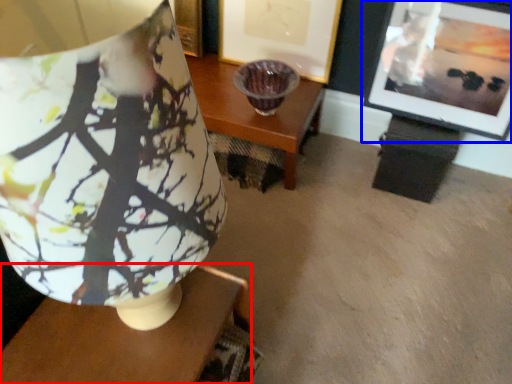
Question: Which object appears closest to the camera in this image, table (highlighted by a red box) or picture frame (highlighted by a blue box)?

Choices:
 (A) table
 (B) picture frame

Answer: (A)